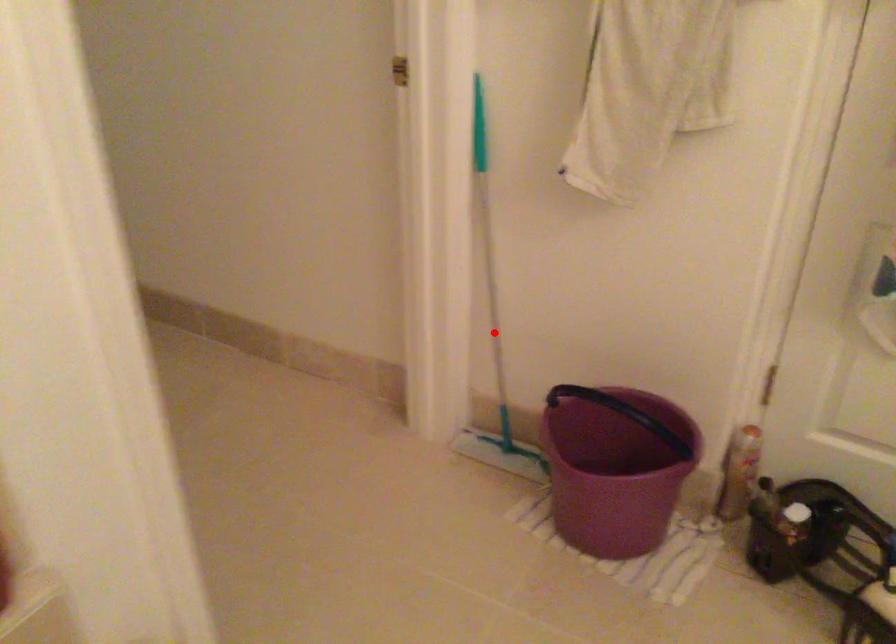
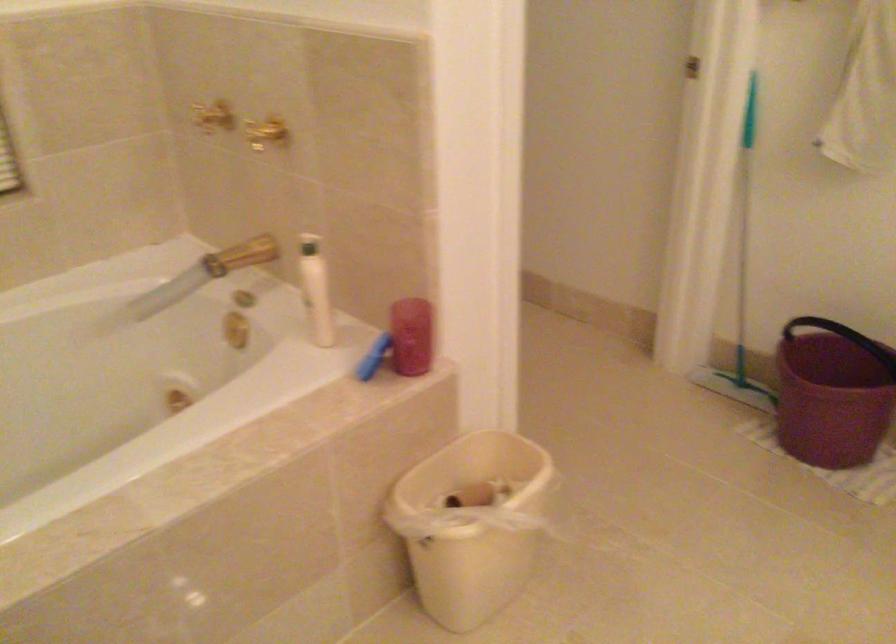
The point at the highlighted location is marked in the first image. Where is the corresponding point in the second image?

(742, 279)